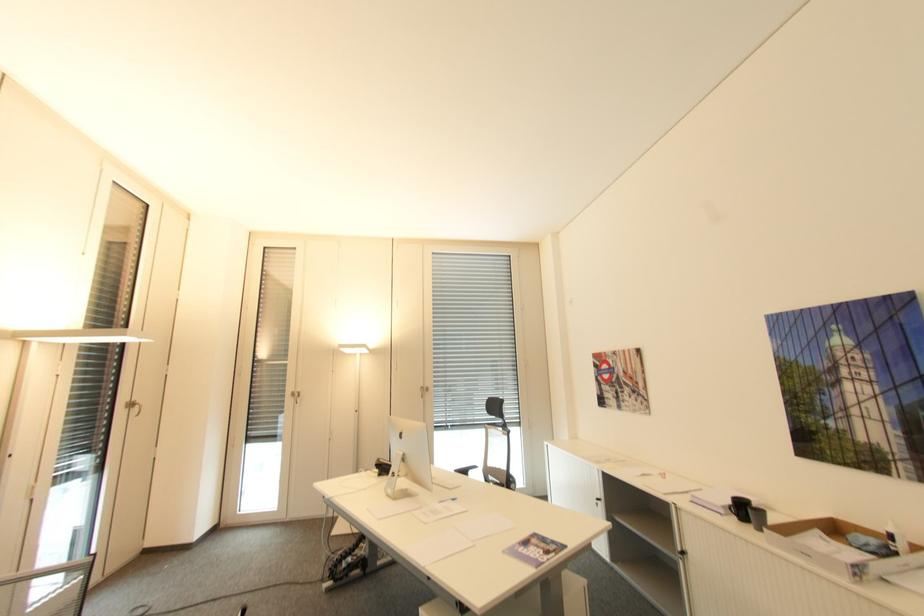
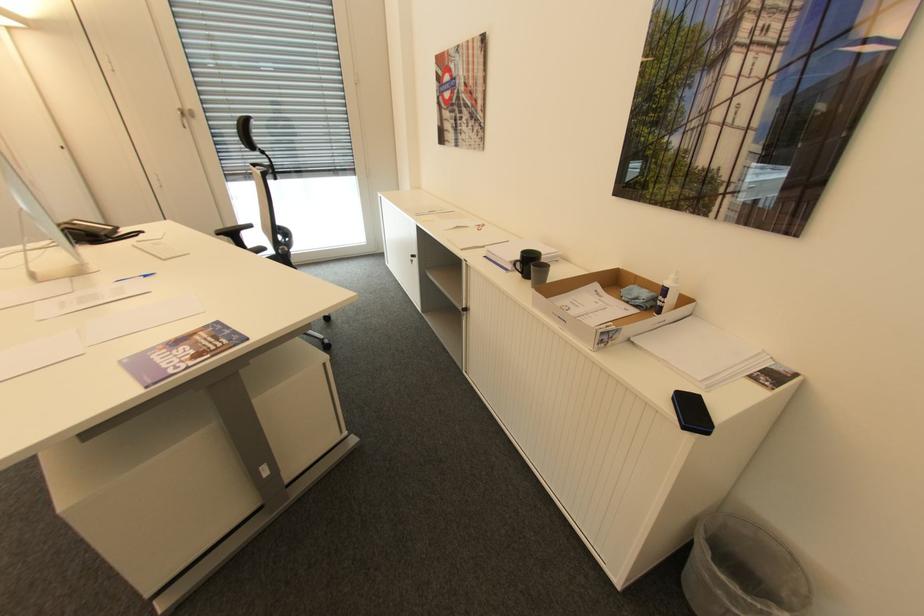
Locate, in the second image, the point that corresponds to [859,575] in the first image.

(606, 342)